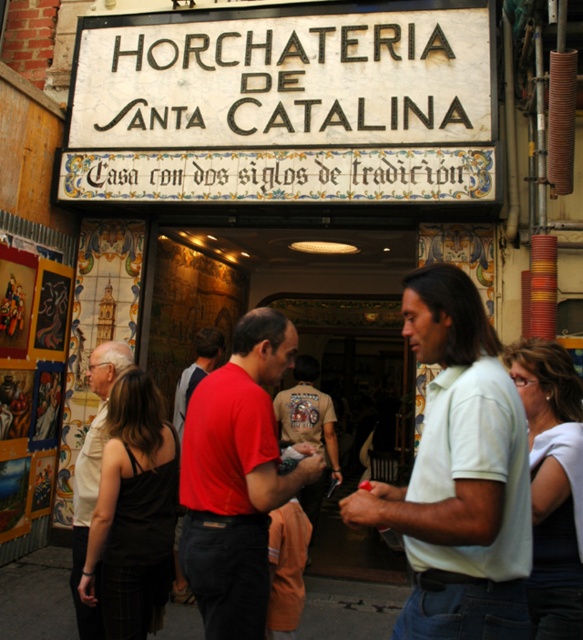
You are standing at the entrance of Horchateria de Santa Catalina and notice a light green cotton shirt at center and a black fabric at center. Which object is closer to you?

The light green cotton shirt at center is closer to you since it is 6.49 feet away from the black fabric at center, meaning it is nearer than the black fabric at center.

What is located at the coordinates point (458, 474)?

The light green cotton shirt at center is located at point (458, 474).

From the picture: You are standing at the entrance of Horchateria de Santa Catalina and see two points marked in the scene. The first point is at coordinate (75, 528) and the second is at (287, 403). Which point is closer to you?

The point at coordinate (75, 528) is closer to you because it is in front of the other point at (287, 403).